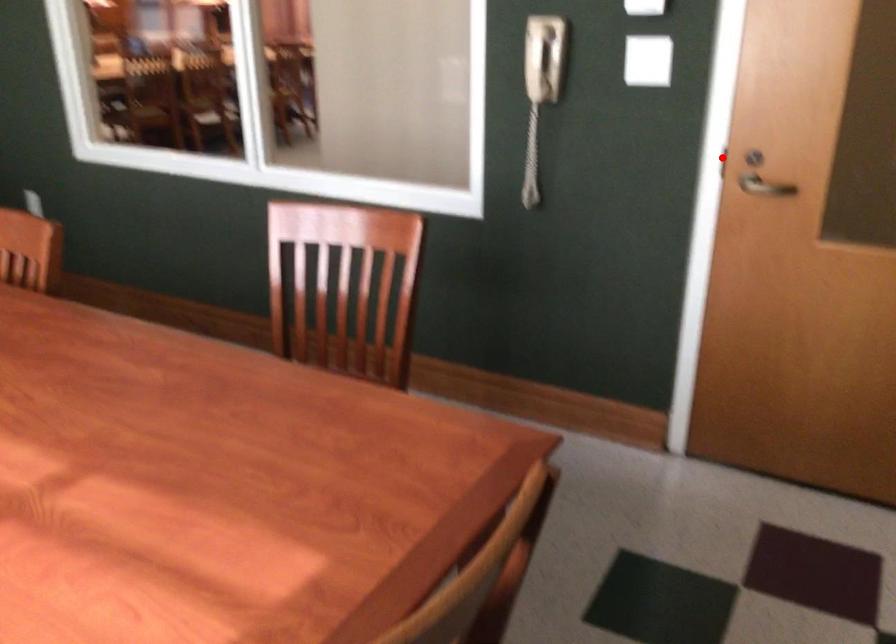
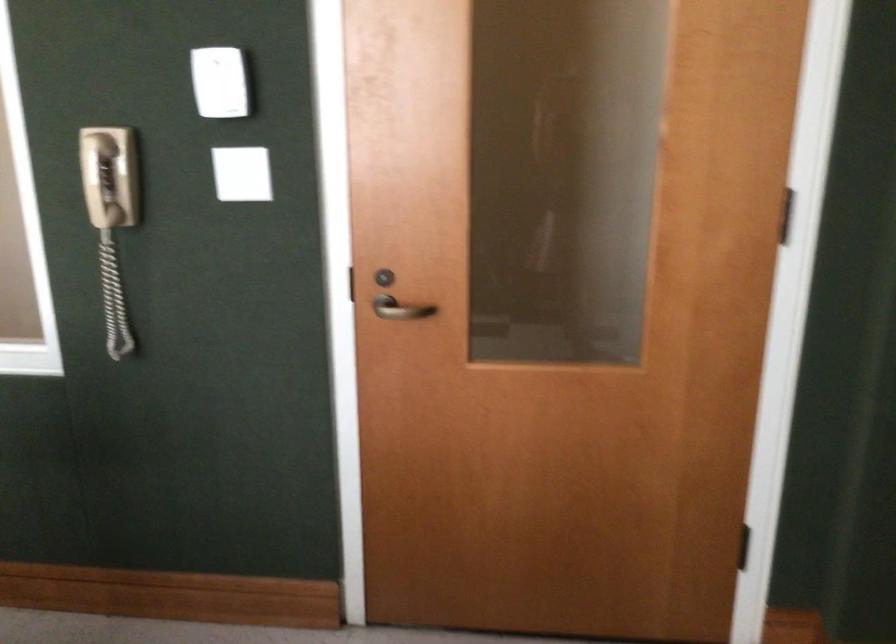
Locate, in the second image, the point that corresponds to the highlighted location in the first image.

(346, 283)